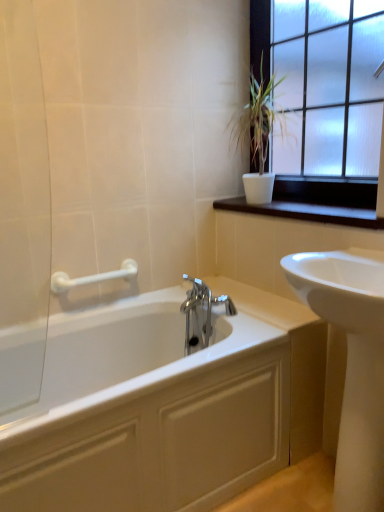
Where is `dark wood window sill at upper right`? dark wood window sill at upper right is located at coordinates (306, 212).

This screenshot has height=512, width=384. In order to click on frosted glass window at upper right in this screenshot , I will do `click(323, 86)`.

The image size is (384, 512). What do you see at coordinates (323, 86) in the screenshot?
I see `frosted glass window at upper right` at bounding box center [323, 86].

Where is `dark wood window sill at upper right`? dark wood window sill at upper right is located at coordinates (306, 212).

Does white plastic grab bar at upper left turn towards frosted glass window at upper right?

No, white plastic grab bar at upper left is not aimed at frosted glass window at upper right.

Is white plastic grab bar at upper left smaller than frosted glass window at upper right?

Indeed, white plastic grab bar at upper left has a smaller size compared to frosted glass window at upper right.

Is white plastic grab bar at upper left beside frosted glass window at upper right?

white plastic grab bar at upper left and frosted glass window at upper right are clearly separated.

Considering the positions of objects white plastic grab bar at upper left and frosted glass window at upper right in the image provided, who is more to the left, white plastic grab bar at upper left or frosted glass window at upper right?

From the viewer's perspective, white plastic grab bar at upper left appears more on the left side.

Could you tell me if white ceramic plant at upper right is turned towards dark wood window sill at upper right?

No, white ceramic plant at upper right is not oriented towards dark wood window sill at upper right.

From the image's perspective, between white ceramic plant at upper right and dark wood window sill at upper right, who is located below?

From the image's view, dark wood window sill at upper right is below.

Does white ceramic plant at upper right lie behind dark wood window sill at upper right?

Yes, it is.

Considering the positions of points (242, 108) and (234, 207), is point (242, 108) farther from camera compared to point (234, 207)?

Yes, point (242, 108) is behind point (234, 207).

Is point (347, 220) positioned in front of point (247, 201)?

Yes, it is.

In the scene shown: Is dark wood window sill at upper right to the right of white ceramic plant at upper right from the viewer's perspective?

Yes, dark wood window sill at upper right is to the right of white ceramic plant at upper right.

Is dark wood window sill at upper right not near white ceramic plant at upper right?

Actually, dark wood window sill at upper right and white ceramic plant at upper right are a little close together.

Locate an element on the screen. The width and height of the screenshot is (384, 512). houseplant on the left side of dark wood window sill at upper right is located at coordinates (259, 134).

Between white ceramic plant at upper right and frosted glass window at upper right, which one has smaller width?

Thinner between the two is frosted glass window at upper right.

From a real-world perspective, who is located lower, white ceramic plant at upper right or frosted glass window at upper right?

white ceramic plant at upper right, from a real-world perspective.

From the image's perspective, is white ceramic plant at upper right above or below frosted glass window at upper right?

white ceramic plant at upper right is below frosted glass window at upper right.

Is frosted glass window at upper right closer to camera compared to white ceramic plant at upper right?

Yes.

This screenshot has height=512, width=384. I want to click on houseplant below the frosted glass window at upper right (from the image's perspective), so click(x=259, y=134).

Based on the photo, from the image's perspective, which one is positioned lower, frosted glass window at upper right or white ceramic plant at upper right?

white ceramic plant at upper right, from the image's perspective.

Does frosted glass window at upper right appear on the right side of white ceramic plant at upper right?

Correct, you'll find frosted glass window at upper right to the right of white ceramic plant at upper right.

From the image's perspective, is white glossy sink at right below dark wood window sill at upper right?

Indeed, from the image's perspective, white glossy sink at right is shown beneath dark wood window sill at upper right.

Between white glossy sink at right and dark wood window sill at upper right, which one is positioned behind?

dark wood window sill at upper right is further from the camera.

Which of these two, white glossy sink at right or dark wood window sill at upper right, is wider?

white glossy sink at right is wider.

Considering the points (341, 459) and (346, 224), which point is in front, point (341, 459) or point (346, 224)?

The point (341, 459) is more forward.

In the scene shown: Does white ceramic plant at upper right have a larger size compared to white glossy sink at right?

Incorrect, white ceramic plant at upper right is not larger than white glossy sink at right.

Based on the photo, from a real-world perspective, which object rests below the other?

white glossy sink at right.

Considering the relative positions of white ceramic plant at upper right and white glossy sink at right in the image provided, is white ceramic plant at upper right to the left of white glossy sink at right from the viewer's perspective?

Yes.

Measure the distance from white ceramic plant at upper right to white glossy sink at right.

The distance of white ceramic plant at upper right from white glossy sink at right is 30.28 inches.

You are a GUI agent. You are given a task and a screenshot of the screen. Output one action in this format:
    pyautogui.click(x=<x>, y=<y>)
    Task: Click on the towel bar that appears below the frosted glass window at upper right (from the image's perspective)
    The width and height of the screenshot is (384, 512).
    Given the screenshot: What is the action you would take?
    pyautogui.click(x=92, y=277)

Find the location of `houseplant located behind the dark wood window sill at upper right`. houseplant located behind the dark wood window sill at upper right is located at coordinates point(259,134).

Based on their spatial positions, is dark wood window sill at upper right or white plastic grab bar at upper left closer to white glossy bathtub at center?

white plastic grab bar at upper left lies closer to white glossy bathtub at center than the other object.

From the image, which object appears to be nearer to white plastic grab bar at upper left, white ceramic plant at upper right or frosted glass window at upper right?

Based on the image, white ceramic plant at upper right appears to be nearer to white plastic grab bar at upper left.

Based on their spatial positions, is dark wood window sill at upper right or white ceramic plant at upper right further from white glossy sink at right?

white ceramic plant at upper right is positioned further to the anchor white glossy sink at right.

When comparing their distances from white glossy bathtub at center, does white glossy sink at right or white plastic grab bar at upper left seem closer?

Based on the image, white glossy sink at right appears to be nearer to white glossy bathtub at center.

Based on their spatial positions, is white plastic grab bar at upper left or white ceramic plant at upper right closer to white glossy bathtub at center?

The object closer to white glossy bathtub at center is white plastic grab bar at upper left.

Which object lies nearer to the anchor point white glossy bathtub at center, white ceramic plant at upper right or white glossy sink at right?

white glossy sink at right is positioned closer to the anchor white glossy bathtub at center.

From the image, which object appears to be farther from white glossy sink at right, white glossy bathtub at center or white ceramic plant at upper right?

The object further to white glossy sink at right is white ceramic plant at upper right.

Based on the photo, which object lies further to the anchor point white glossy sink at right, white plastic grab bar at upper left or white ceramic plant at upper right?

white plastic grab bar at upper left is further to white glossy sink at right.

This screenshot has width=384, height=512. In order to click on bathtub between white plastic grab bar at upper left and dark wood window sill at upper right in this screenshot , I will do `click(150, 412)`.

The height and width of the screenshot is (512, 384). Find the location of `window sill between white plastic grab bar at upper left and white glossy sink at right in the horizontal direction`. window sill between white plastic grab bar at upper left and white glossy sink at right in the horizontal direction is located at coordinates (306, 212).

Find the location of `sink between dark wood window sill at upper right and white glossy bathtub at center from top to bottom`. sink between dark wood window sill at upper right and white glossy bathtub at center from top to bottom is located at coordinates (352, 365).

You are a GUI agent. You are given a task and a screenshot of the screen. Output one action in this format:
    pyautogui.click(x=<x>, y=<y>)
    Task: Click on the window sill between white ceramic plant at upper right and white glossy sink at right from top to bottom
    
    Given the screenshot: What is the action you would take?
    pyautogui.click(x=306, y=212)